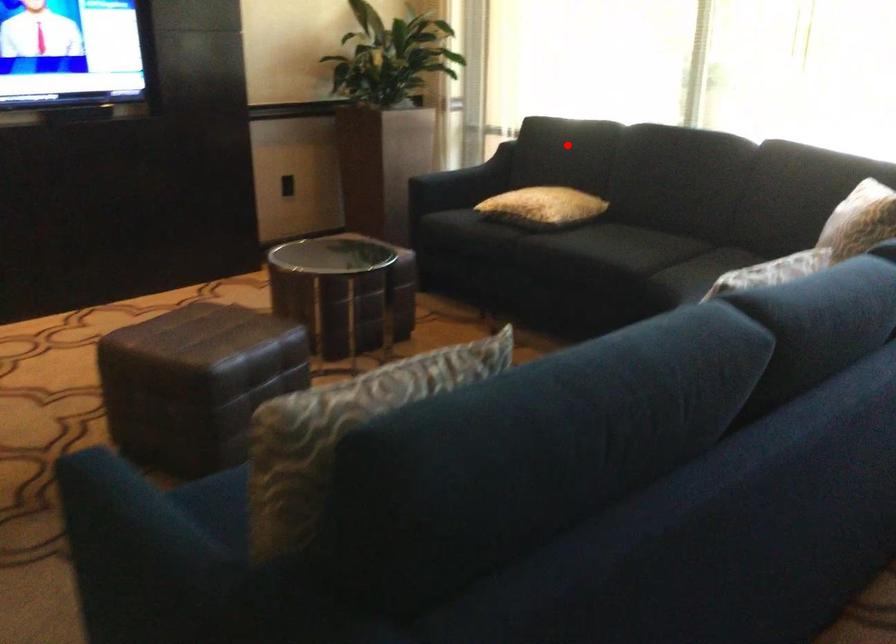
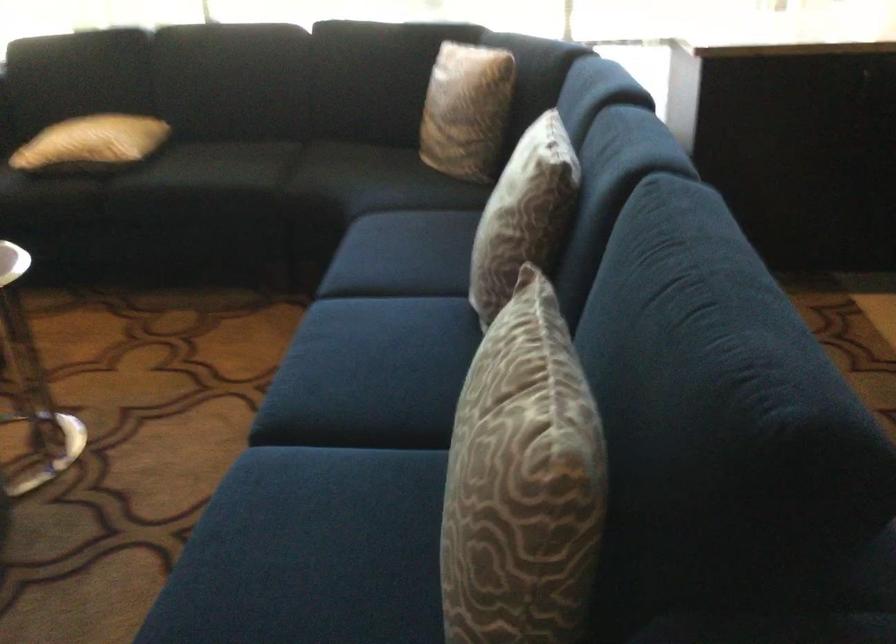
Question: I am providing you with two images of the same scene from different viewpoints. Image1 has a red point marked. In image2, the corresponding 3D location appears at what relative position? Reply with the corresponding letter.

Choices:
 (A) Closer
 (B) Farther

Answer: (A)